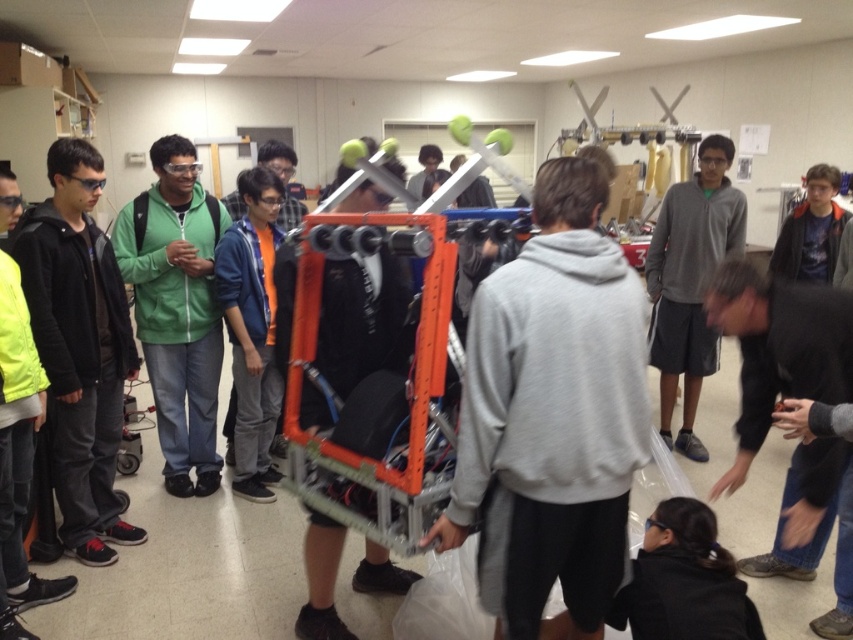
Is gray sweatshirt at center smaller than gray hoodie at center?

Yes.

Between gray sweatshirt at center and gray hoodie at center, which one is positioned higher?

gray hoodie at center is above.

The width and height of the screenshot is (853, 640). Describe the element at coordinates (552, 417) in the screenshot. I see `gray sweatshirt at center` at that location.

Where is `gray sweatshirt at center`? gray sweatshirt at center is located at coordinates (552, 417).

Measure the distance between black fabric at lower right and camera.

1.87 meters

Does black fabric at lower right have a greater height compared to orange fabric shirt at center?

Yes, black fabric at lower right is taller than orange fabric shirt at center.

Between point (753, 348) and point (287, 173), which one is positioned in front?

Point (753, 348)

The width and height of the screenshot is (853, 640). What are the coordinates of `black fabric at lower right` in the screenshot? It's located at (778, 348).

Which of these two, gray sweatshirt at center or black fabric at lower right, stands taller?

With more height is gray sweatshirt at center.

Which is behind, point (628, 490) or point (722, 483)?

The point (722, 483) is more distant.

Which is behind, point (561, 579) or point (747, 385)?

The point (747, 385) is behind.

The image size is (853, 640). What are the coordinates of `gray sweatshirt at center` in the screenshot? It's located at (552, 417).